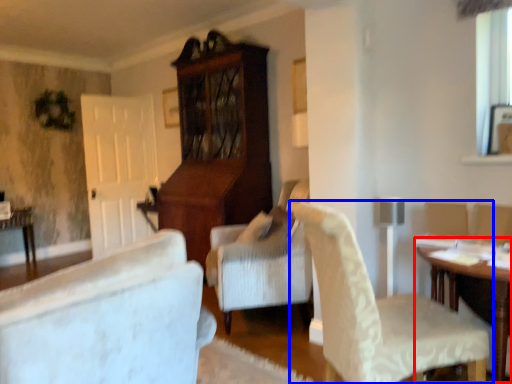
Question: Among these objects, which one is farthest to the camera, table (highlighted by a red box) or chair (highlighted by a blue box)?

Choices:
 (A) table
 (B) chair

Answer: (A)